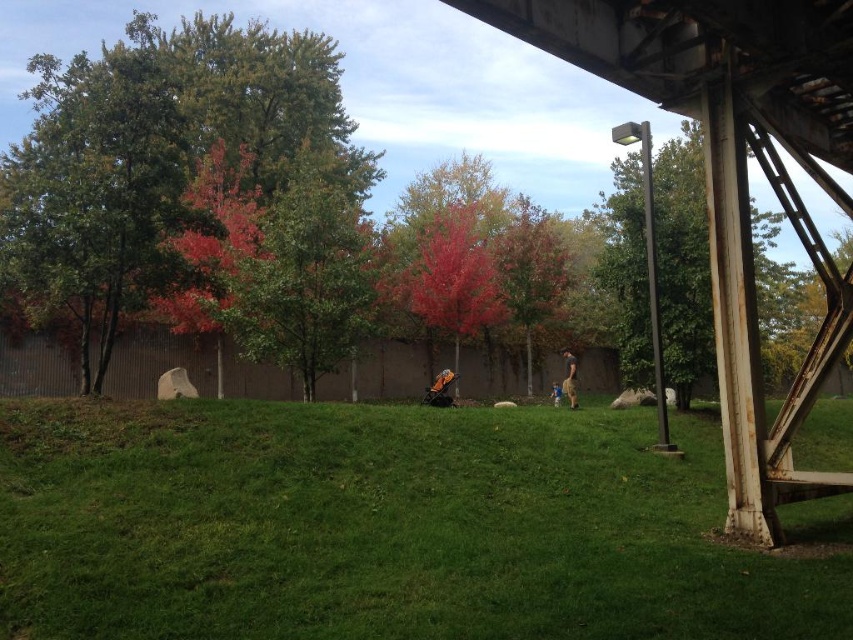
You are standing in an autumn scene with a green leafy tree at left and a light brown leather jacket at center. Which object is wider?

The green leafy tree at left is wider than the light brown leather jacket at center.

Looking at this image, you are standing in an autumn outdoor scene. You see green grassy at lower center and blue jeans at center. Which object is closer to the ground?

The blue jeans at center are closer to the ground because the green grassy at lower center is above it.